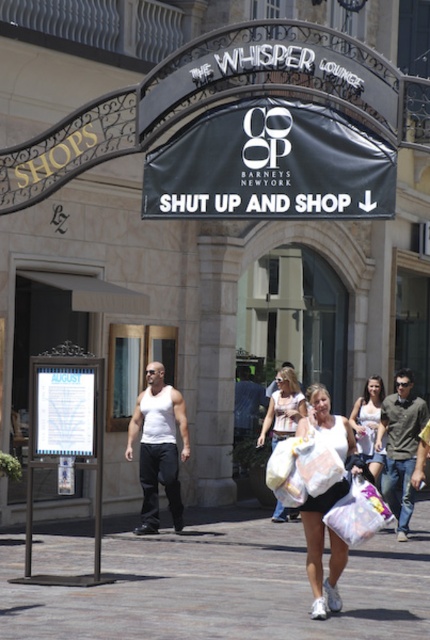
You are a customer in the shopping area. You see a man wearing a white tank top at center and a woman carrying a white matte plastic bag at center. Which object is closer to the left side of the image?

The white tank top at center is closer to the left side of the image because it is positioned to the left of the white matte plastic bag at center.

You are a photographer trying to capture a candid shot of the denim jeans at center and the white cotton shirt at center in the shopping area. Since you want both items to be clearly visible in your photo, which one should you focus on first to ensure proper focus, considering their sizes?

The denim jeans at center is taller than the white cotton shirt at center, so you should focus on the denim jeans at center first to ensure proper focus as it is larger and more prominent in the frame.

You are a photographer trying to capture a shot of the white tank top at center and the white matte plastic bag at center. Which object should you focus on first if you want to ensure both are in focus without adjusting your camera settings?

You should focus on the white tank top at center first because it is closer to the viewer than the white matte plastic bag at center, so focusing on the closer object will keep both in focus when using a shallow depth of field.